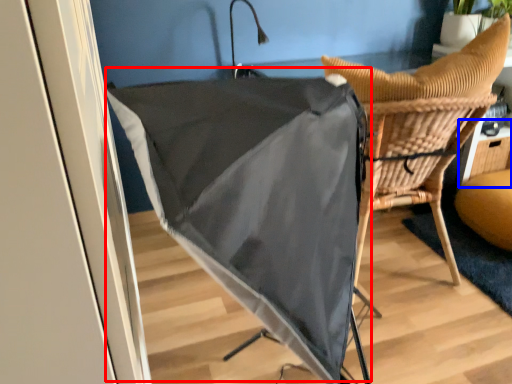
Question: Which of the following is the closest to the observer, umbrella (highlighted by a red box) or table (highlighted by a blue box)?

Choices:
 (A) umbrella
 (B) table

Answer: (A)